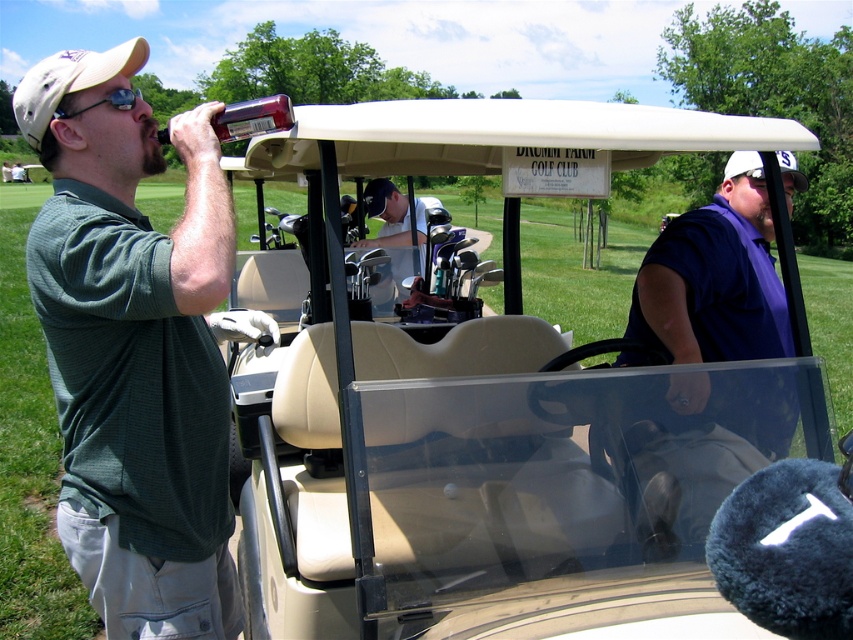
Describe the element at coordinates (135, 346) in the screenshot. I see `green matte shirt at left` at that location.

Can you confirm if green matte shirt at left is positioned to the left of purple cotton shirt at center?

Correct, you'll find green matte shirt at left to the left of purple cotton shirt at center.

Locate an element on the screen. green matte shirt at left is located at coordinates (135, 346).

Is the position of purple cotton shirt at center less distant than that of translucent plastic bottle at upper left?

No, it is behind translucent plastic bottle at upper left.

The image size is (853, 640). I want to click on purple cotton shirt at center, so click(x=715, y=278).

Does point (647, 314) come in front of point (280, 96)?

No, it is behind (280, 96).

Find the location of a particular element. purple cotton shirt at center is located at coordinates (715, 278).

Is purple cotton shirt at center to the right of metallic golf clubs at center from the viewer's perspective?

Indeed, purple cotton shirt at center is positioned on the right side of metallic golf clubs at center.

Can you confirm if purple cotton shirt at center is positioned to the left of metallic golf clubs at center?

In fact, purple cotton shirt at center is to the right of metallic golf clubs at center.

Is point (741, 260) farther from viewer compared to point (389, 228)?

No, it is in front of (389, 228).

At what (x,y) coordinates should I click in order to perform the action: click on purple cotton shirt at center. Please return your answer as a coordinate pair (x, y). The width and height of the screenshot is (853, 640). Looking at the image, I should click on (715, 278).